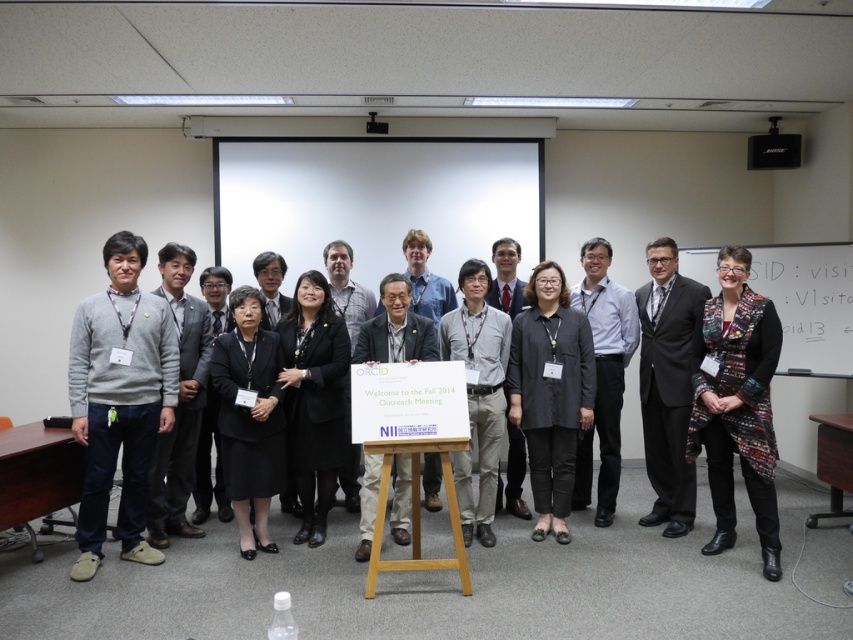
You are organizing a presentation and need to move a 1.2 meter wide screen to the left side of the room. Currently, the whiteboard at upper right and the light gray shirt at center are in the way. Based on their positions, can you determine if there is enough space to move the screen to the left without hitting either object?

The whiteboard at upper right is to the right of the light gray shirt at center. Since the screen is 1.2 meters wide and needs to be moved to the left side, the space between the light gray shirt at center and the whiteboard at upper right must be considered. However, without knowing the exact distance between them, it is impossible to confirm if there is sufficient space. Please measure the available space before moving the screen.

You are a photographer standing at the back of the room near the projector screen. You want to ensure that both the multicolored woven vest at right and the light gray shirt at center are in focus in your photo. Given that your camera can only focus on objects within a 30 inch range, will you be able to capture both subjects clearly?

The distance between the multicolored woven vest at right and light gray shirt at center is 32.13 inches, which exceeds the camera focus range of 30 inches. Therefore, both subjects cannot be in focus simultaneously.

You are an event planner arranging a presentation in the conference room. You need to place a 1.2 meter wide screen between the whiteboard at upper right and the light gray shirt at center. Can the space accommodate the screen?

The whiteboard at upper right might be wider than light gray shirt at center, so the space between them could potentially accommodate a 1.2 meter wide screen. However, since the exact width difference isn not specified, it is recommended to measure the space before placing the screen.